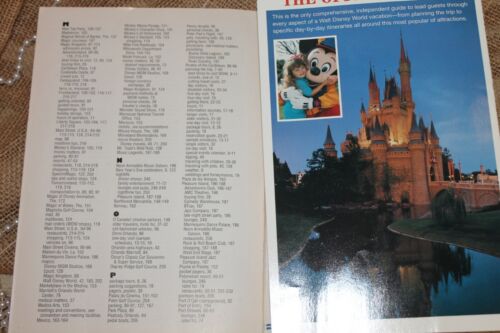
This screenshot has height=333, width=500. I want to click on book, so (x=35, y=152).